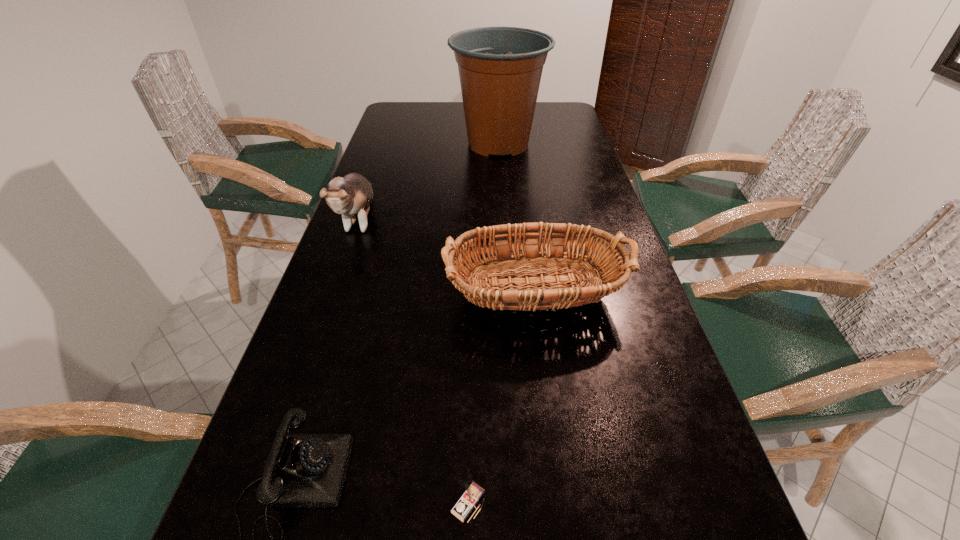
Identify the location of object situated at the left edge. The width and height of the screenshot is (960, 540). (351, 195).

You are a GUI agent. You are given a task and a screenshot of the screen. Output one action in this format:
    pyautogui.click(x=<x>, y=<y>)
    Task: Click on the flowerpot that is at the right edge
    
    Given the screenshot: What is the action you would take?
    pyautogui.click(x=500, y=68)

Find the location of a particular element. The image size is (960, 540). basket present at the right edge is located at coordinates (608, 270).

In order to click on object at the far right corner in this screenshot , I will do `click(500, 68)`.

Where is `free location at the left edge of the desktop`? This screenshot has width=960, height=540. free location at the left edge of the desktop is located at coordinates (382, 148).

Find the location of a particular element. Image resolution: width=960 pixels, height=540 pixels. vacant point at the right edge is located at coordinates (551, 131).

Find the location of a particular element. The width and height of the screenshot is (960, 540). free space at the far left corner of the desktop is located at coordinates (417, 117).

Locate an element on the screen. This screenshot has width=960, height=540. vacant area that lies between the flowerpot and the matchbox is located at coordinates (483, 323).

The width and height of the screenshot is (960, 540). I want to click on free space between the matchbox and the cat, so click(x=414, y=361).

Find the location of a particular element. This screenshot has height=540, width=960. vacant space in between the matchbox and the basket is located at coordinates (500, 398).